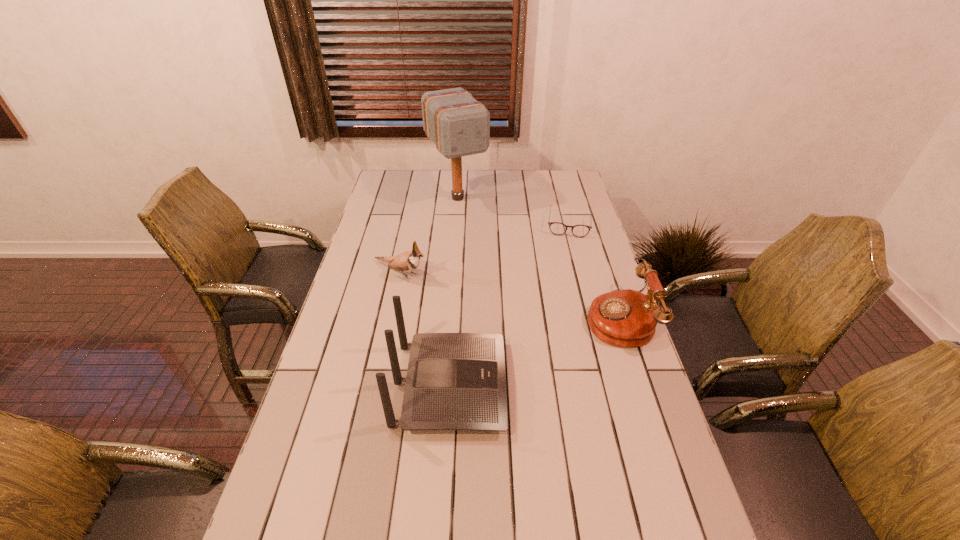
Where is `vacant region that satisfies the following two spatial constraints: 1. on the front side of the tallest object; 2. on the dial of the telephone`? vacant region that satisfies the following two spatial constraints: 1. on the front side of the tallest object; 2. on the dial of the telephone is located at coordinates (449, 318).